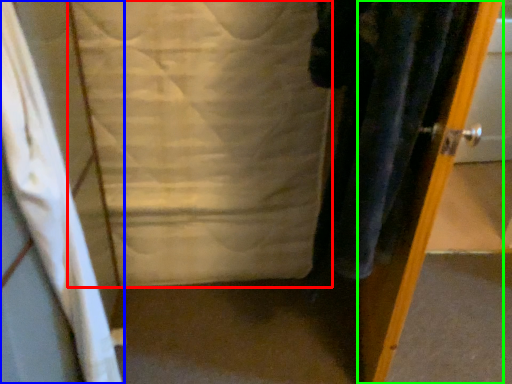
Question: Considering the real-world distances, which object is closest to sheet (highlighted by a red box)? curtain (highlighted by a blue box) or door (highlighted by a green box).

Choices:
 (A) curtain
 (B) door

Answer: (A)